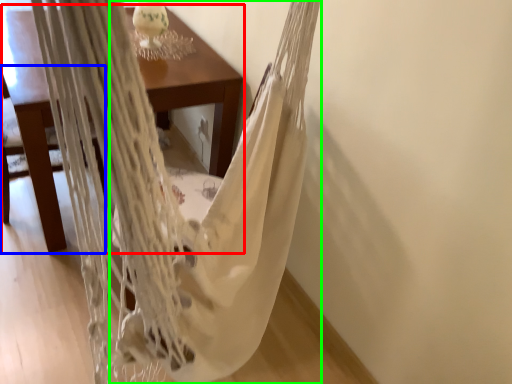
Question: Which object is positioned closest to table (highlighted by a red box)? Select from armchair (highlighted by a blue box) and blanket (highlighted by a green box).

Choices:
 (A) armchair
 (B) blanket

Answer: (B)